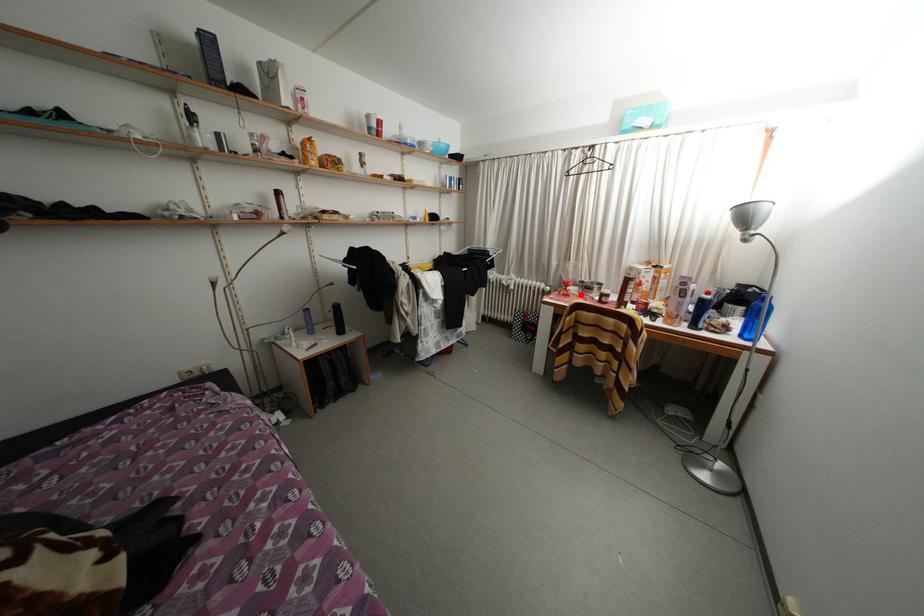
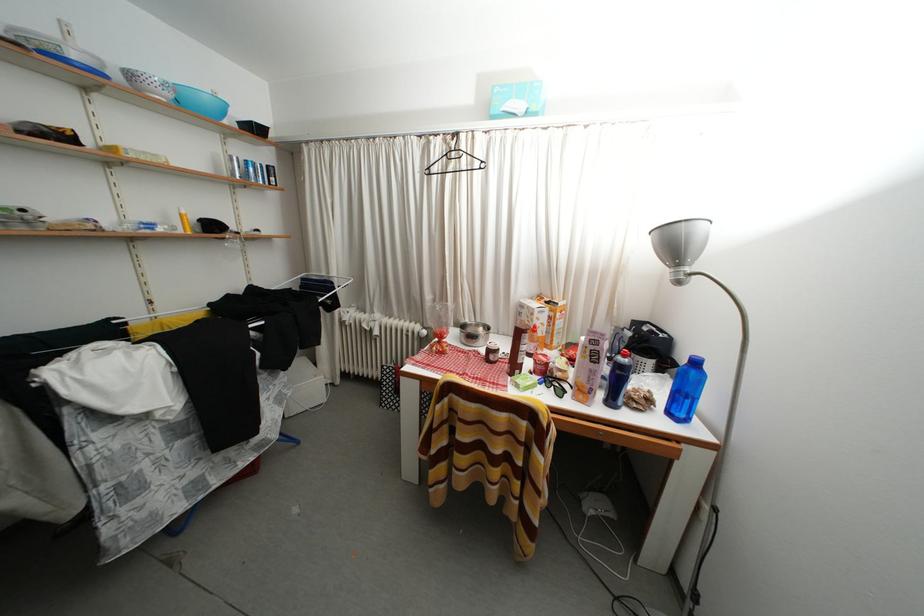
In the second image, find the point that corresponds to the highlighted location in the first image.

(460, 342)